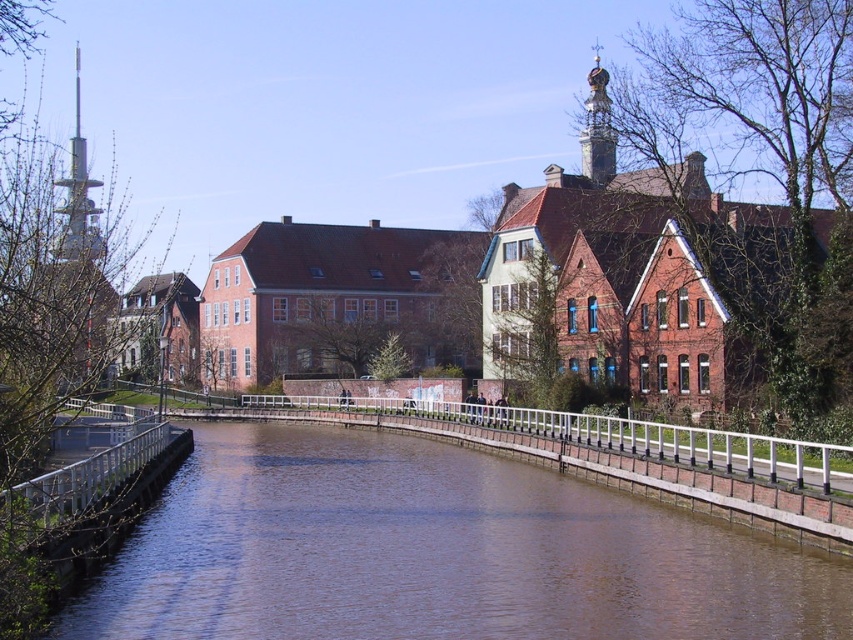
Question: Which of these objects is positioned farthest from the brown smooth water at center?

Choices:
 (A) brushed metal tower at left
 (B) gold ornate tower at upper center

Answer: (B)

Question: Can you confirm if brown smooth water at center is positioned below gold ornate tower at upper center?

Choices:
 (A) yes
 (B) no

Answer: (A)

Question: Does brown smooth water at center have a larger size compared to brushed metal tower at left?

Choices:
 (A) yes
 (B) no

Answer: (B)

Question: Which object appears farthest from the camera in this image?

Choices:
 (A) gold ornate tower at upper center
 (B) brushed metal tower at left
 (C) brown smooth water at center

Answer: (A)

Question: Which point is farther to the camera?

Choices:
 (A) brushed metal tower at left
 (B) gold ornate tower at upper center
 (C) brown smooth water at center

Answer: (B)

Question: From the image, what is the correct spatial relationship of brushed metal tower at left in relation to gold ornate tower at upper center?

Choices:
 (A) above
 (B) below

Answer: (B)